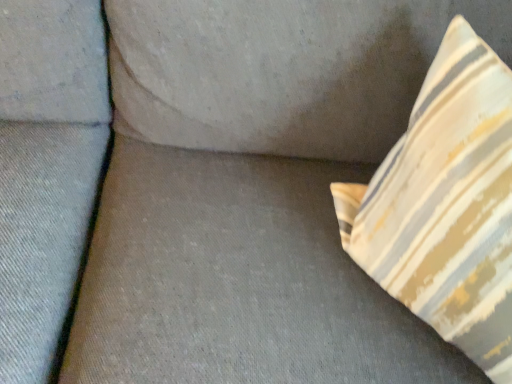
The height and width of the screenshot is (384, 512). What are the coordinates of `striped fabric pillow at right` in the screenshot? It's located at (446, 205).

What do you see at coordinates (446, 205) in the screenshot? I see `striped fabric pillow at right` at bounding box center [446, 205].

What are the coordinates of `striped fabric pillow at right` in the screenshot? It's located at (446, 205).